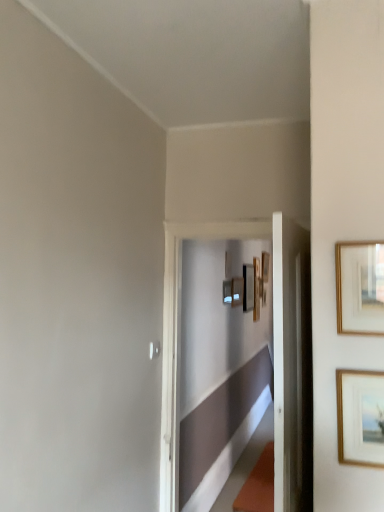
Question: Is gold-framed picture at right, the 6th picture frame from the back, wider or thinner than wooden picture frame at center, which appears as the third picture frame when viewed from the back?

Choices:
 (A) thin
 (B) wide

Answer: (A)

Question: Is point (347, 439) positioned closer to the camera than point (235, 279)?

Choices:
 (A) farther
 (B) closer

Answer: (B)

Question: Estimate the real-world distances between objects in this image. Which object is closer to the matte black picture frame at center, the second picture frame when ordered from back to front?

Choices:
 (A) gold-framed picture at upper right, marked as the 2th picture frame in a front-to-back arrangement
 (B) wooden picture frame at center, which ranks as the 1th picture frame in back-to-front order
 (C) gold-framed picture at right, the 6th picture frame from the back
 (D) matte black picture frame at center, which is the third picture frame from front to back
 (E) wooden picture frame at center, which appears as the third picture frame when viewed from the back

Answer: (B)

Question: Which object is the farthest from the gold-framed picture at right, the first picture frame when ordered from front to back?

Choices:
 (A) wooden picture frame at center, which appears as the third picture frame when viewed from the back
 (B) matte black picture frame at center, which is counted as the 4th picture frame, starting from the back
 (C) gold-framed picture at upper right, positioned as the 5th picture frame in back-to-front order
 (D) wooden picture frame at center, the sixth picture frame when ordered from front to back
 (E) matte black picture frame at center, the second picture frame when ordered from back to front

Answer: (E)